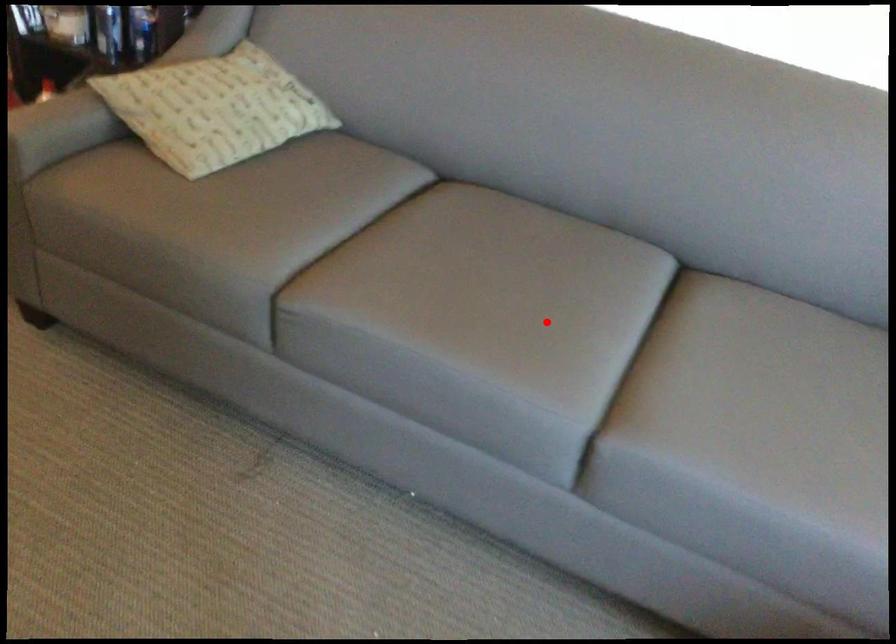
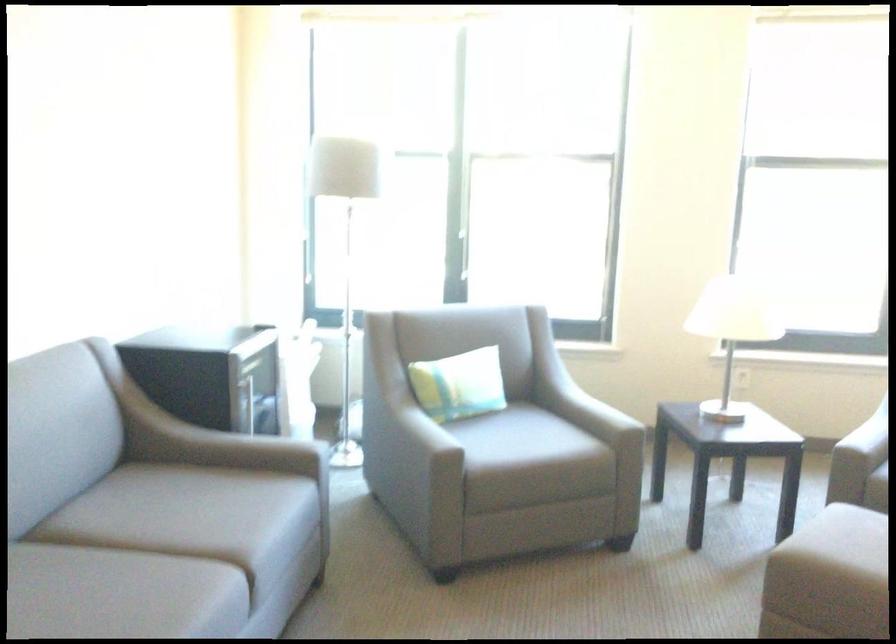
The point at the highlighted location is marked in the first image. Where is the corresponding point in the second image?

(119, 594)